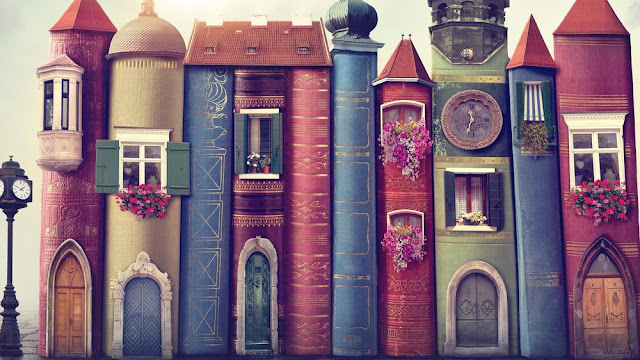
Locate an element on the screen. This screenshot has height=360, width=640. book is located at coordinates 507,129.